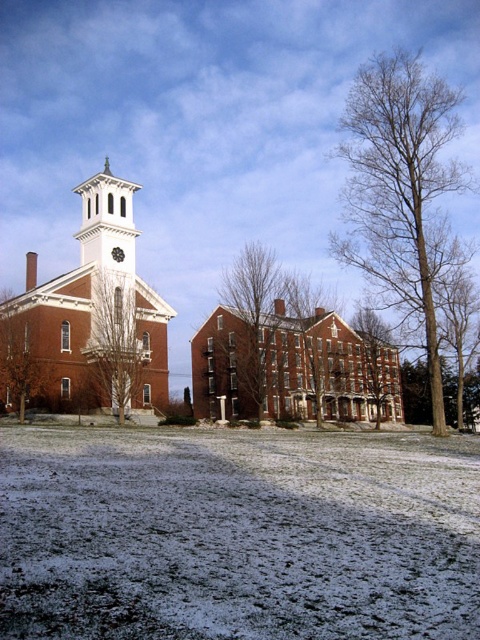
Question: Which of the following is the farthest from the observer?

Choices:
 (A) (78, 298)
 (B) (252, 326)

Answer: (B)

Question: Which object is the farthest from the bare branches at center?

Choices:
 (A) brown textured tree at left
 (B) snowy grass at center
 (C) bare wood tree at center
 (D) brown textured tree at center

Answer: (B)

Question: Can you confirm if snowy grass at center is positioned to the right of bare branches at center?

Choices:
 (A) no
 (B) yes

Answer: (B)

Question: Considering the relative positions of bare branches at center and brown wood tree at left in the image provided, where is bare branches at center located with respect to brown wood tree at left?

Choices:
 (A) left
 (B) right

Answer: (B)

Question: Which is farther from the bare branches at center?

Choices:
 (A) brown textured tree at center
 (B) brown textured tree at left
 (C) bare wood tree at center

Answer: (B)

Question: Does snowy grass at center appear on the right side of bare wood tree at right?

Choices:
 (A) yes
 (B) no

Answer: (B)